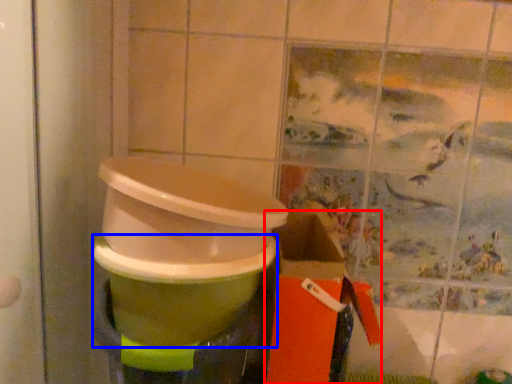
Question: Which object appears closest to the camera in this image, box (highlighted by a red box) or toilet bowl (highlighted by a blue box)?

Choices:
 (A) box
 (B) toilet bowl

Answer: (B)